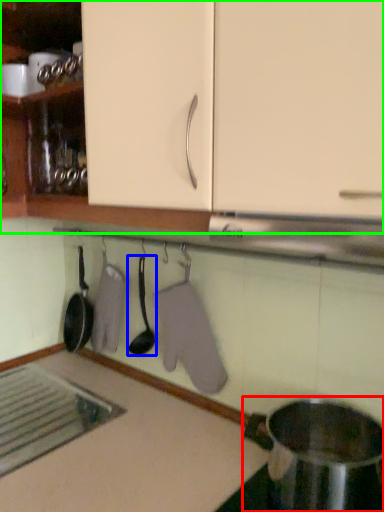
Question: Which is farther away from appliance (highlighted by a red box)? spoon (highlighted by a blue box) or cabinetry (highlighted by a green box)?

Choices:
 (A) spoon
 (B) cabinetry

Answer: (B)